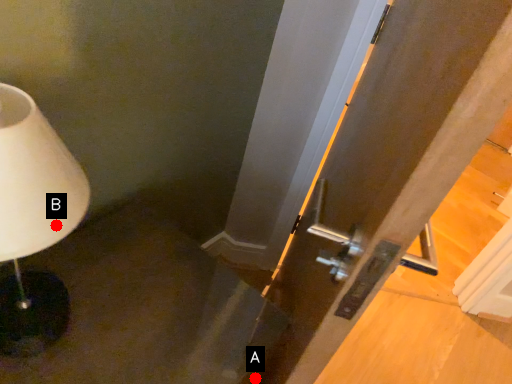
Question: Two points are circled on the image, labeled by A and B beside each circle. Which point is farther from the camera taking this photo?

Choices:
 (A) A is further
 (B) B is further

Answer: (A)